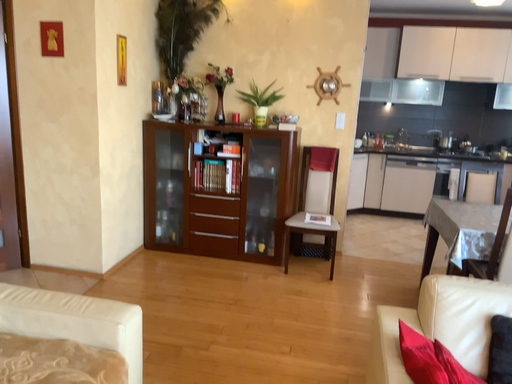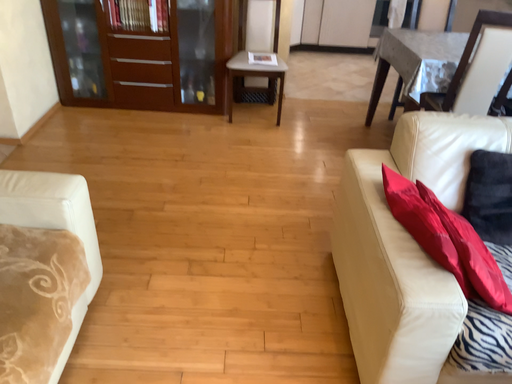
Question: How did the camera likely rotate when shooting the video?

Choices:
 (A) rotated upward
 (B) rotated downward

Answer: (B)